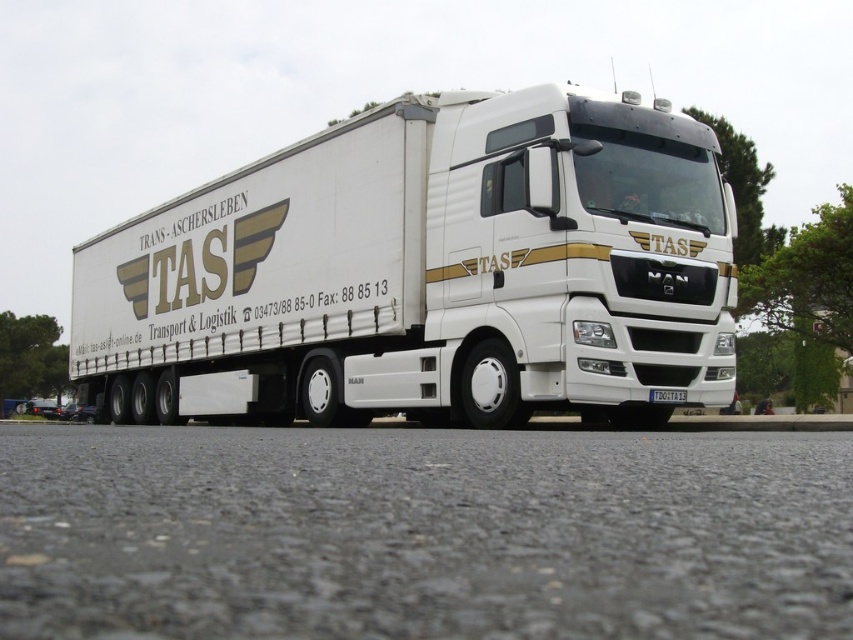
Question: Is the position of white glossy truck at center less distant than that of white plastic license plate at center?

Choices:
 (A) no
 (B) yes

Answer: (B)

Question: Which object is farther from the camera taking this photo?

Choices:
 (A) white plastic license plate at center
 (B) white glossy truck at center

Answer: (A)

Question: In this image, where is white glossy truck at center located relative to white plastic license plate at center?

Choices:
 (A) right
 (B) left

Answer: (B)

Question: Does white glossy truck at center appear over white plastic license plate at center?

Choices:
 (A) yes
 (B) no

Answer: (A)